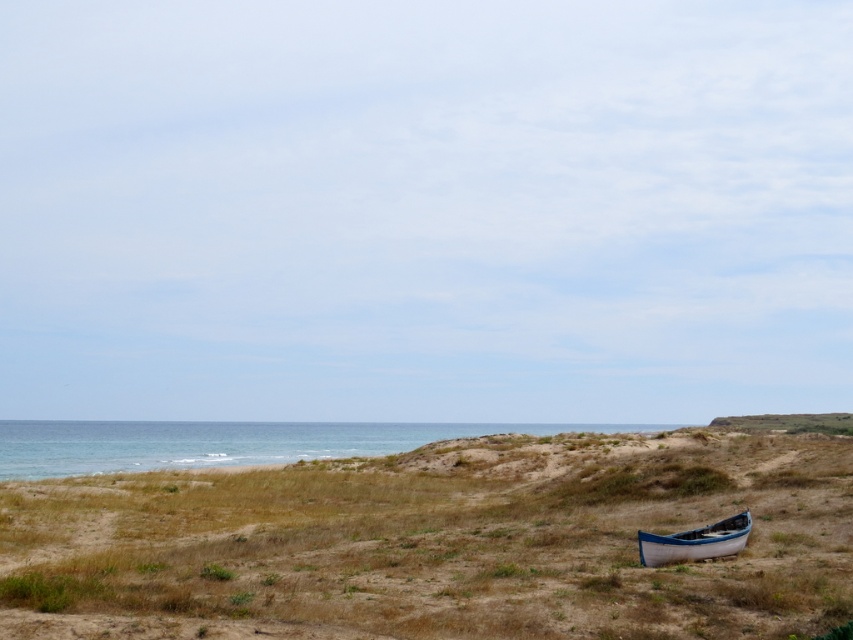
You are a hiker who has just arrived at the coastal landscape. You see the brown grassy hillside at lower right and the white canvas canoe at lower right. Which object is closer to you?

The brown grassy hillside at lower right is closer to you as it is positioned in front of the white canvas canoe at lower right.

You are planning to set up a campsite in this coastal area and have both the brown grassy hillside at lower right and the white canvas canoe at lower right available. Which location would you choose for a larger camping area and why?

The brown grassy hillside at lower right has a larger size compared to the white canvas canoe at lower right, so it would be more suitable for a larger camping area.

You are standing on the beach and notice the brown grassy hillside at lower right and the blue water at lower left. Which of these two features occupies a larger area in the scene?

The blue water at lower left occupies a larger area in the scene than the brown grassy hillside at lower right because the brown grassy hillside at lower right is smaller than blue water at lower left.